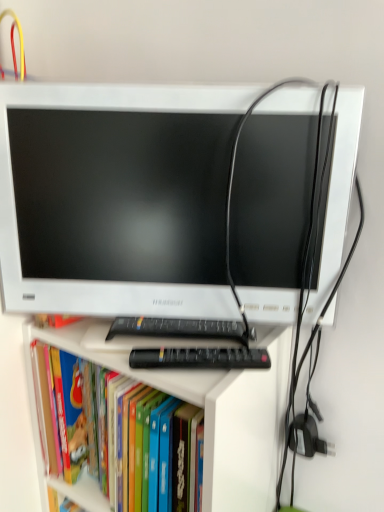
Question: Is black plastic keyboard at center to the right of hardcover book at center from the viewer's perspective?

Choices:
 (A) no
 (B) yes

Answer: (B)

Question: Does black plastic keyboard at center have a greater width compared to hardcover book at center?

Choices:
 (A) yes
 (B) no

Answer: (B)

Question: Is black plastic keyboard at center next to hardcover book at center and touching it?

Choices:
 (A) yes
 (B) no

Answer: (B)

Question: Considering the relative sizes of black plastic keyboard at center and hardcover book at center in the image provided, is black plastic keyboard at center taller than hardcover book at center?

Choices:
 (A) yes
 (B) no

Answer: (B)

Question: Is there a large distance between black plastic keyboard at center and hardcover book at center?

Choices:
 (A) no
 (B) yes

Answer: (A)

Question: Is black plastic keyboard at center wider or thinner than white plastic computer monitor at center?

Choices:
 (A) wide
 (B) thin

Answer: (B)

Question: Is black plastic keyboard at center inside or outside of white plastic computer monitor at center?

Choices:
 (A) outside
 (B) inside

Answer: (B)

Question: From the image's perspective, relative to white plastic computer monitor at center, is black plastic keyboard at center above or below?

Choices:
 (A) below
 (B) above

Answer: (A)

Question: From a real-world perspective, is black plastic keyboard at center above or below white plastic computer monitor at center?

Choices:
 (A) below
 (B) above

Answer: (A)

Question: In terms of height, does hardcover book at center look taller or shorter compared to black plastic keyboard at center?

Choices:
 (A) short
 (B) tall

Answer: (B)

Question: In terms of size, does hardcover book at center appear bigger or smaller than black plastic keyboard at center?

Choices:
 (A) small
 (B) big

Answer: (B)

Question: Does point (158, 419) appear closer or farther from the camera than point (147, 324)?

Choices:
 (A) farther
 (B) closer

Answer: (B)

Question: Is hardcover book at center wider or thinner than black plastic keyboard at center?

Choices:
 (A) wide
 (B) thin

Answer: (A)

Question: Based on their sizes in the image, would you say white plastic computer monitor at center is bigger or smaller than hardcover book at center?

Choices:
 (A) big
 (B) small

Answer: (B)

Question: Is point (94, 96) positioned closer to the camera than point (94, 379)?

Choices:
 (A) closer
 (B) farther

Answer: (A)